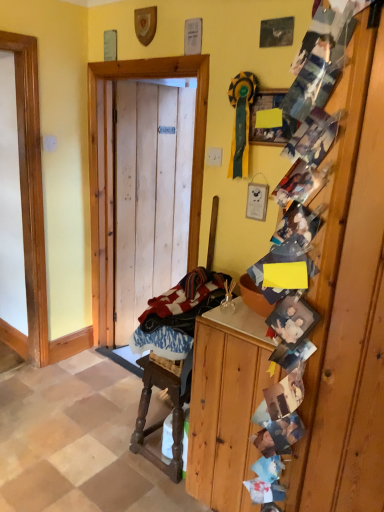
Find the location of a particular element. Image resolution: width=384 pixels, height=512 pixels. blue and white fabric at lower center is located at coordinates (176, 317).

Describe the element at coordinates (271, 128) in the screenshot. I see `matte yellow paper at upper center` at that location.

What is the approximate height of wooden door at center?

wooden door at center is 1.87 meters tall.

Where is `wooden cabinet at right`? This screenshot has width=384, height=512. wooden cabinet at right is located at coordinates (226, 405).

Identify the location of wooden carved rocking chair at center. (162, 420).

The width and height of the screenshot is (384, 512). Identify the location of blue and white fabric at lower center. (176, 317).

Which is in front, point (171, 325) or point (209, 280)?

The point (171, 325) is in front.

Which object is closer to the camera taking this photo, blue and white fabric at lower center or wooden carved rocking chair at center?

blue and white fabric at lower center is in front.

How many degrees apart are the facing directions of blue and white fabric at lower center and wooden carved rocking chair at center?

blue and white fabric at lower center and wooden carved rocking chair at center are facing 2.8 degrees away from each other.

Is blue and white fabric at lower center positioned beyond the bounds of wooden carved rocking chair at center?

Yes, blue and white fabric at lower center is outside of wooden carved rocking chair at center.

Based on the photo, does wooden carved rocking chair at center touch wooden cabinet at right?

No, wooden carved rocking chair at center is not making contact with wooden cabinet at right.

Where is `cabinetry located in front of the wooden carved rocking chair at center`? Image resolution: width=384 pixels, height=512 pixels. cabinetry located in front of the wooden carved rocking chair at center is located at coordinates (226, 405).

Is wooden carved rocking chair at center positioned with its back to wooden cabinet at right?

No, wooden cabinet at right is not at the back of wooden carved rocking chair at center.

Is wooden carved rocking chair at center behind wooden cabinet at right?

Yes, the depth of wooden carved rocking chair at center is greater than that of wooden cabinet at right.

Are wooden cabinet at right and matte yellow paper at upper center beside each other?

wooden cabinet at right and matte yellow paper at upper center are not in contact.

Is wooden cabinet at right taller or shorter than matte yellow paper at upper center?

Clearly, wooden cabinet at right is taller compared to matte yellow paper at upper center.

From a real-world perspective, which is physically above, wooden cabinet at right or matte yellow paper at upper center?

In real-world perspective, matte yellow paper at upper center is above.

From the image's perspective, which is above, wooden cabinet at right or matte yellow paper at upper center?

matte yellow paper at upper center.

Locate an element on the screen. rocking chair behind the wooden cabinet at right is located at coordinates (162, 420).

Are wooden cabinet at right and wooden carved rocking chair at center beside each other?

No, wooden cabinet at right is not next to wooden carved rocking chair at center.

From a real-world perspective, who is located higher, wooden cabinet at right or wooden carved rocking chair at center?

wooden cabinet at right.

Does wooden cabinet at right have a greater height compared to wooden carved rocking chair at center?

Indeed, wooden cabinet at right has a greater height compared to wooden carved rocking chair at center.

Can you confirm if matte yellow paper at upper center is positioned to the right of blue and white fabric at lower center?

Yes, matte yellow paper at upper center is to the right of blue and white fabric at lower center.

Does matte yellow paper at upper center have a smaller size compared to blue and white fabric at lower center?

Indeed, matte yellow paper at upper center has a smaller size compared to blue and white fabric at lower center.

Identify the location of picture frame above the blue and white fabric at lower center (from the image's perspective). This screenshot has width=384, height=512. (271, 128).

Can you confirm if matte yellow paper at upper center is wider than blue and white fabric at lower center?

No, matte yellow paper at upper center is not wider than blue and white fabric at lower center.

What's the angular difference between wooden carved rocking chair at center and blue and white fabric at lower center's facing directions?

The angular difference between wooden carved rocking chair at center and blue and white fabric at lower center is 2.8 degrees.

From a real-world perspective, which is physically below, wooden carved rocking chair at center or blue and white fabric at lower center?

From a 3D spatial view, wooden carved rocking chair at center is below.

Is wooden carved rocking chair at center at the left side of blue and white fabric at lower center?

Yes.

Is matte yellow paper at upper center positioned before wooden carved rocking chair at center?

Yes, matte yellow paper at upper center is closer to the camera.

From the image's perspective, does matte yellow paper at upper center appear lower than wooden carved rocking chair at center?

No, from the image's perspective, matte yellow paper at upper center is not beneath wooden carved rocking chair at center.

Is matte yellow paper at upper center facing towards wooden carved rocking chair at center?

No, matte yellow paper at upper center is not oriented towards wooden carved rocking chair at center.

Choose the correct answer: Is matte yellow paper at upper center inside wooden carved rocking chair at center or outside it?

The correct answer is: outside.

Identify the location of laundry on the right of wooden carved rocking chair at center. Image resolution: width=384 pixels, height=512 pixels. (176, 317).

Where is `cabinetry that is above the wooden carved rocking chair at center (from a real-world perspective)`? cabinetry that is above the wooden carved rocking chair at center (from a real-world perspective) is located at coordinates (226, 405).

Looking at the image, which one is located closer to blue and white fabric at lower center, wooden door at center or wooden cabinet at right?

wooden cabinet at right.

Which object lies further to the anchor point matte yellow paper at upper center, wooden door at center or blue and white fabric at lower center?

blue and white fabric at lower center lies further to matte yellow paper at upper center than the other object.

When comparing their distances from matte yellow paper at upper center, does wooden carved rocking chair at center or wooden door at center seem closer?

wooden door at center is closer to matte yellow paper at upper center.

Based on the photo, which object lies nearer to the anchor point wooden door at center, blue and white fabric at lower center or wooden cabinet at right?

The object closer to wooden door at center is blue and white fabric at lower center.

Based on their spatial positions, is wooden cabinet at right or blue and white fabric at lower center further from matte yellow paper at upper center?

wooden cabinet at right is positioned further to the anchor matte yellow paper at upper center.

From the image, which object appears to be farther from wooden door at center, wooden carved rocking chair at center or matte yellow paper at upper center?

The object further to wooden door at center is wooden carved rocking chair at center.

Looking at the image, which one is located further to wooden cabinet at right, blue and white fabric at lower center or wooden carved rocking chair at center?

Based on the image, blue and white fabric at lower center appears to be further to wooden cabinet at right.

When comparing their distances from wooden door at center, does wooden carved rocking chair at center or blue and white fabric at lower center seem closer?

blue and white fabric at lower center is positioned closer to the anchor wooden door at center.

The height and width of the screenshot is (512, 384). I want to click on picture frame positioned between blue and white fabric at lower center and wooden door at center from near to far, so [x=271, y=128].

What are the coordinates of `laundry between matte yellow paper at upper center and wooden cabinet at right in the vertical direction` in the screenshot? It's located at (176, 317).

Locate an element on the screen. rocking chair between wooden cabinet at right and wooden door at center from front to back is located at coordinates (162, 420).

Find the location of a particular element. door between matte yellow paper at upper center and wooden carved rocking chair at center from top to bottom is located at coordinates (113, 169).